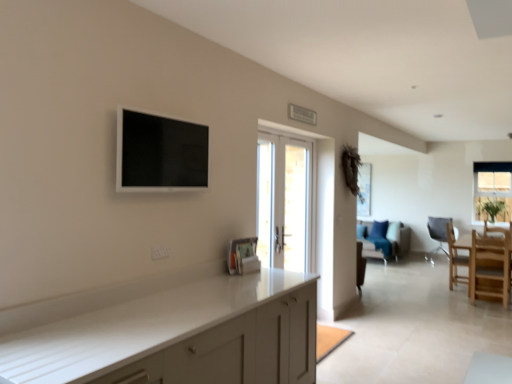
In order to face light wood chair at lower right, the 1th chair from the front, should I rotate leftwards or rightwards?

You should rotate right by 28.652 degrees.

This screenshot has width=512, height=384. Describe the element at coordinates (493, 191) in the screenshot. I see `clear glass window at upper right` at that location.

Where is `matte gray chair at right, which is the 1th chair from back to front`? The height and width of the screenshot is (384, 512). matte gray chair at right, which is the 1th chair from back to front is located at coordinates (438, 231).

Locate an element on the screen. The image size is (512, 384). white glossy door at center is located at coordinates (284, 203).

Where is `light wood chair at lower right, the 1th chair from the front`? This screenshot has width=512, height=384. light wood chair at lower right, the 1th chair from the front is located at coordinates (490, 268).

Is matte black flat screen tv at upper left facing towards white glossy door at center?

No, matte black flat screen tv at upper left is not oriented towards white glossy door at center.

The height and width of the screenshot is (384, 512). I want to click on flat that appears in front of the white glossy door at center, so pos(160,153).

Which is farther from the camera, (133, 165) or (260, 228)?

Point (260, 228)

Considering the positions of objects matte black flat screen tv at upper left and white glossy door at center in the image provided, who is more to the right, matte black flat screen tv at upper left or white glossy door at center?

white glossy door at center.

Can you confirm if matte black flat screen tv at upper left is shorter than matte gray chair at right, marked as the third chair in a front-to-back arrangement?

Correct, matte black flat screen tv at upper left is not as tall as matte gray chair at right, marked as the third chair in a front-to-back arrangement.

Considering the relative sizes of matte black flat screen tv at upper left and matte gray chair at right, which is the 1th chair from back to front, in the image provided, is matte black flat screen tv at upper left smaller than matte gray chair at right, which is the 1th chair from back to front,?

Yes.

From a real-world perspective, relative to matte gray chair at right, which is the 1th chair from back to front, is matte black flat screen tv at upper left vertically above or below?

matte black flat screen tv at upper left is above matte gray chair at right, which is the 1th chair from back to front.

Would you say matte black flat screen tv at upper left is a long distance from matte gray chair at right, marked as the third chair in a front-to-back arrangement?

Indeed, matte black flat screen tv at upper left is not near matte gray chair at right, marked as the third chair in a front-to-back arrangement.

Considering the sizes of objects velvet blue couch at center and light wood chair at lower right, acting as the 3th chair starting from the back, in the image provided, who is taller, velvet blue couch at center or light wood chair at lower right, acting as the 3th chair starting from the back,?

Standing taller between the two is light wood chair at lower right, acting as the 3th chair starting from the back.

Is there a large distance between velvet blue couch at center and light wood chair at lower right, the 1th chair from the front?

Absolutely, velvet blue couch at center is distant from light wood chair at lower right, the 1th chair from the front.

Is velvet blue couch at center wider than light wood chair at lower right, the 1th chair from the front?

Indeed, velvet blue couch at center has a greater width compared to light wood chair at lower right, the 1th chair from the front.

Between velvet blue couch at center and white glossy door at center, which one appears on the right side from the viewer's perspective?

velvet blue couch at center.

In the image, is velvet blue couch at center positioned in front of or behind white glossy door at center?

velvet blue couch at center is behind white glossy door at center.

Would you say velvet blue couch at center is a long distance from white glossy door at center?

velvet blue couch at center is far away from white glossy door at center.

Is velvet blue couch at center bigger than white glossy door at center?

Indeed, velvet blue couch at center has a larger size compared to white glossy door at center.

Does point (159, 150) appear closer or farther from the camera than point (452, 237)?

Point (159, 150) is closer to the camera than point (452, 237).

Would you say matte black flat screen tv at upper left is a long distance from wooden chair at right, the 2th chair from the back?

matte black flat screen tv at upper left is far away from wooden chair at right, the 2th chair from the back.

From their relative heights in the image, would you say matte black flat screen tv at upper left is taller or shorter than wooden chair at right, placed as the 2th chair when sorted from front to back?

matte black flat screen tv at upper left is shorter than wooden chair at right, placed as the 2th chair when sorted from front to back.

Considering the relative sizes of matte black flat screen tv at upper left and wooden chair at right, placed as the 2th chair when sorted from front to back, in the image provided, is matte black flat screen tv at upper left smaller than wooden chair at right, placed as the 2th chair when sorted from front to back,?

Yes.

Is velvet blue couch at center thinner than wooden chair at right, the 2th chair from the back?

Incorrect, the width of velvet blue couch at center is not less than that of wooden chair at right, the 2th chair from the back.

From a real-world perspective, does velvet blue couch at center stand above wooden chair at right, placed as the 2th chair when sorted from front to back?

Actually, velvet blue couch at center is physically below wooden chair at right, placed as the 2th chair when sorted from front to back, in the real world.

Is velvet blue couch at center further to the viewer compared to wooden chair at right, the 2th chair from the back?

Yes, it is behind wooden chair at right, the 2th chair from the back.

Is velvet blue couch at center positioned with its back to wooden chair at right, placed as the 2th chair when sorted from front to back?

That's not correct — velvet blue couch at center is not looking away from wooden chair at right, placed as the 2th chair when sorted from front to back.

Is light wood chair at lower right, the 1th chair from the front, positioned far away from matte black flat screen tv at upper left?

Indeed, light wood chair at lower right, the 1th chair from the front, is not near matte black flat screen tv at upper left.

How different are the orientations of light wood chair at lower right, acting as the 3th chair starting from the back, and matte black flat screen tv at upper left in degrees?

The angle between the facing direction of light wood chair at lower right, acting as the 3th chair starting from the back, and the facing direction of matte black flat screen tv at upper left is 92.6 degrees.

Considering the positions of objects light wood chair at lower right, the 1th chair from the front, and matte black flat screen tv at upper left in the image provided, who is behind, light wood chair at lower right, the 1th chair from the front, or matte black flat screen tv at upper left?

light wood chair at lower right, the 1th chair from the front, is further from the camera.

How distant is light wood chair at lower right, acting as the 3th chair starting from the back, from matte black flat screen tv at upper left?

light wood chair at lower right, acting as the 3th chair starting from the back, and matte black flat screen tv at upper left are 4.57 meters apart.

I want to click on flat above the white glossy door at center (from the image's perspective), so click(x=160, y=153).

From the image's perspective, which chair is the 1st one below the matte black flat screen tv at upper left? Please provide its 2D coordinates.

[(438, 231)]

From the image, which object appears to be farther from matte black flat screen tv at upper left, light wood chair at lower right, acting as the 3th chair starting from the back, or wooden chair at right, the 2th chair from the back?

wooden chair at right, the 2th chair from the back, is positioned further to the anchor matte black flat screen tv at upper left.

Which object lies nearer to the anchor point velvet blue couch at center, clear glass window at upper right or matte black flat screen tv at upper left?

clear glass window at upper right is closer to velvet blue couch at center.

Looking at the image, which one is located closer to wooden chair at right, placed as the 2th chair when sorted from front to back, clear glass window at upper right or matte gray chair at right, marked as the third chair in a front-to-back arrangement?

clear glass window at upper right.

Estimate the real-world distances between objects in this image. Which object is further from wooden chair at right, the 2th chair from the back, light wood chair at lower right, acting as the 3th chair starting from the back, or matte gray chair at right, marked as the third chair in a front-to-back arrangement?

matte gray chair at right, marked as the third chair in a front-to-back arrangement, is further to wooden chair at right, the 2th chair from the back.

Considering their positions, is white glossy door at center positioned further to light wood chair at lower right, the 1th chair from the front, than clear glass window at upper right?

Among the two, white glossy door at center is located further to light wood chair at lower right, the 1th chair from the front.

Which object lies further to the anchor point clear glass window at upper right, wooden chair at right, the 2th chair from the back, or matte gray chair at right, which is the 1th chair from back to front?

wooden chair at right, the 2th chair from the back, is further to clear glass window at upper right.

Looking at the image, which one is located closer to white glossy door at center, wooden chair at right, placed as the 2th chair when sorted from front to back, or matte gray chair at right, which is the 1th chair from back to front?

wooden chair at right, placed as the 2th chair when sorted from front to back, is positioned closer to the anchor white glossy door at center.

Based on their spatial positions, is white glossy door at center or velvet blue couch at center closer to matte black flat screen tv at upper left?

white glossy door at center is closer to matte black flat screen tv at upper left.

Identify the location of couch between light wood chair at lower right, the 1th chair from the front, and clear glass window at upper right in the front-back direction. The width and height of the screenshot is (512, 384). (388, 243).

Locate an element on the screen. The height and width of the screenshot is (384, 512). couch positioned between matte black flat screen tv at upper left and clear glass window at upper right from near to far is located at coordinates (388, 243).

At what (x,y) coordinates should I click in order to perform the action: click on door positioned between matte black flat screen tv at upper left and wooden chair at right, the 2th chair from the back, from near to far. Please return your answer as a coordinate pair (x, y). The width and height of the screenshot is (512, 384). Looking at the image, I should click on (284, 203).

You are a GUI agent. You are given a task and a screenshot of the screen. Output one action in this format:
    pyautogui.click(x=<x>, y=<y>)
    Task: Click on the door between matte black flat screen tv at upper left and matte gray chair at right, which is the 1th chair from back to front, from front to back
    The width and height of the screenshot is (512, 384).
    Given the screenshot: What is the action you would take?
    pyautogui.click(x=284, y=203)